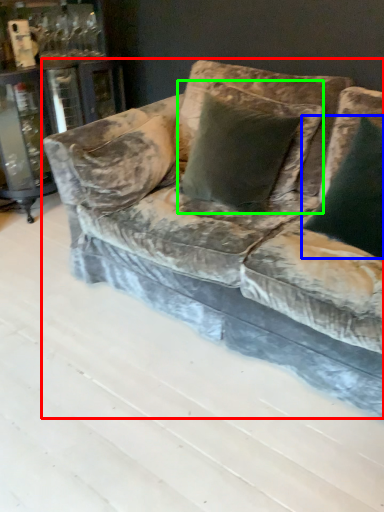
Question: Considering the real-world distances, which object is closest to studio couch (highlighted by a red box)? pillow (highlighted by a blue box) or pillow (highlighted by a green box).

Choices:
 (A) pillow
 (B) pillow

Answer: (B)